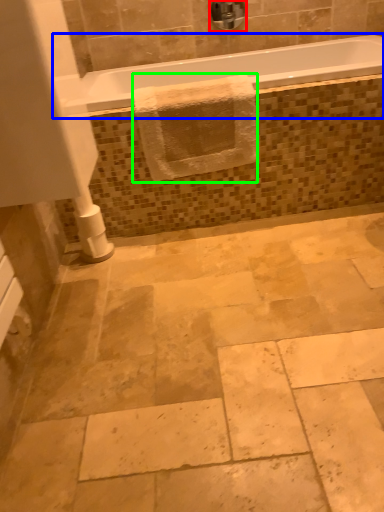
Question: Considering the real-world distances, which object is farthest from faucet (highlighted by a red box)? bathtub (highlighted by a blue box) or bath towel (highlighted by a green box)?

Choices:
 (A) bathtub
 (B) bath towel

Answer: (B)